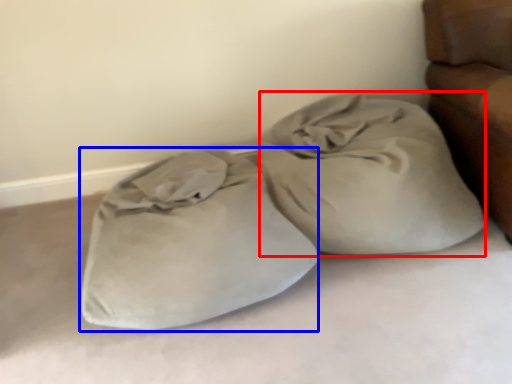
Question: Which object appears closest to the camera in this image, sack (highlighted by a red box) or sleeping bag (highlighted by a blue box)?

Choices:
 (A) sack
 (B) sleeping bag

Answer: (B)